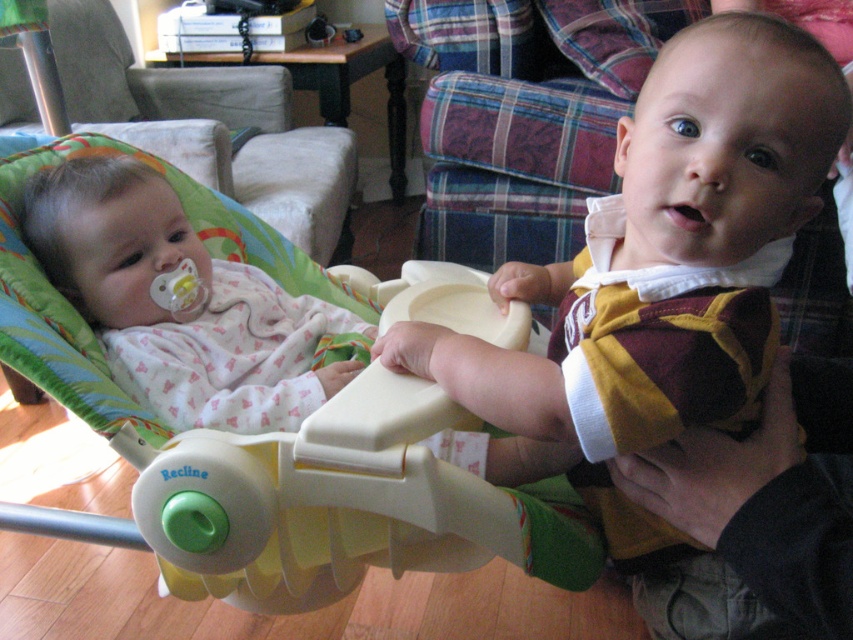
Question: Which of the following is the closest to the observer?

Choices:
 (A) (347, 497)
 (B) (99, 204)
 (C) (796, 33)

Answer: (C)

Question: Does maroon felt baby at center appear over white plastic baby carriage at left?

Choices:
 (A) no
 (B) yes

Answer: (B)

Question: Is white plastic baby carriage at left positioned in front of white soft baby at left?

Choices:
 (A) yes
 (B) no

Answer: (A)

Question: Is maroon felt baby at center bigger than white plastic baby carriage at left?

Choices:
 (A) yes
 (B) no

Answer: (B)

Question: Estimate the real-world distances between objects in this image. Which object is farther from the white plastic baby carriage at left?

Choices:
 (A) maroon felt baby at center
 (B) white soft baby at left

Answer: (A)

Question: Estimate the real-world distances between objects in this image. Which object is closer to the white soft baby at left?

Choices:
 (A) white plastic baby carriage at left
 (B) maroon felt baby at center

Answer: (A)